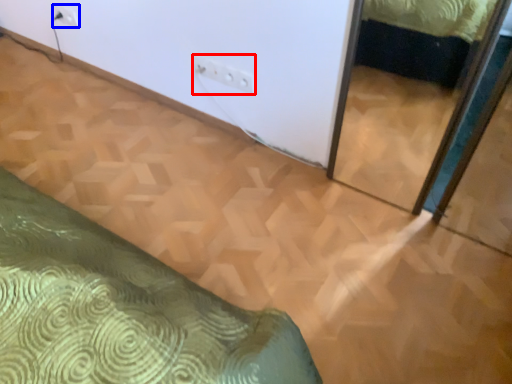
Question: Among these objects, which one is farthest to the camera, electric outlet (highlighted by a red box) or electric outlet (highlighted by a blue box)?

Choices:
 (A) electric outlet
 (B) electric outlet

Answer: (B)